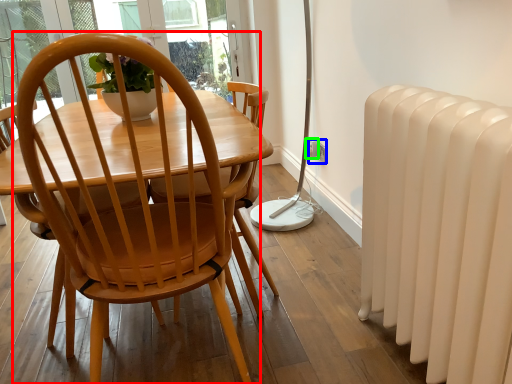
Question: Which is nearer to the chair (highlighted by a red box)? power outlet (highlighted by a blue box) or electric outlet (highlighted by a green box).

Choices:
 (A) power outlet
 (B) electric outlet

Answer: (A)